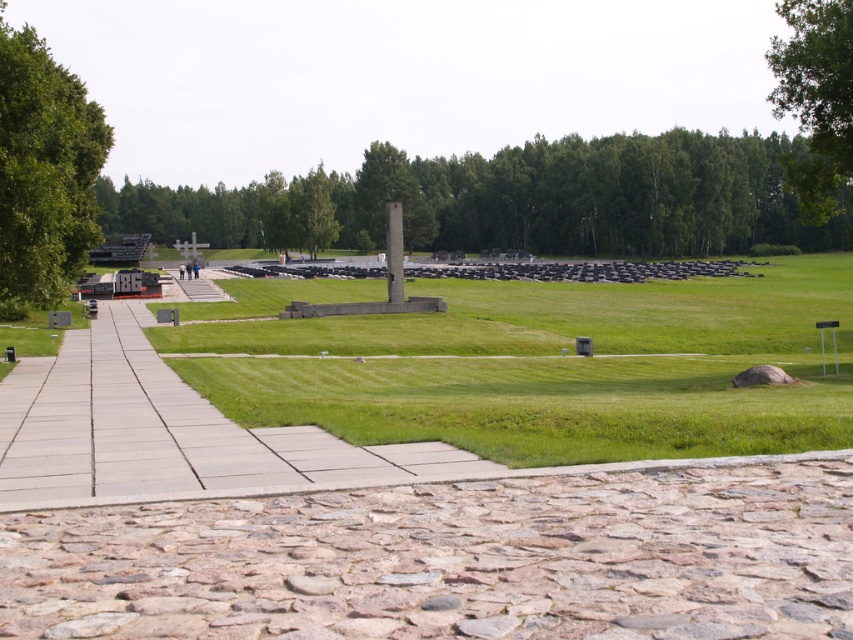
You are standing at the entrance of the memorial site and want to walk towards the tall rectangular stone column in the center. There are two points marked as point 1 at coordinates (486, 346) and point 2 at coordinates (410, 234). Which point should you pass through first while moving towards the column?

You should pass through point 1 at coordinates (486, 346) first because it is in front of point 2 at coordinates (410, 234) along your path towards the column.

You are standing at the entrance of the memorial site and see the green leafy tree at left and the green leafy tree at upper right. Which tree is positioned lower in the image?

→ The green leafy tree at left is positioned lower in the image because it is located below the green leafy tree at upper right.